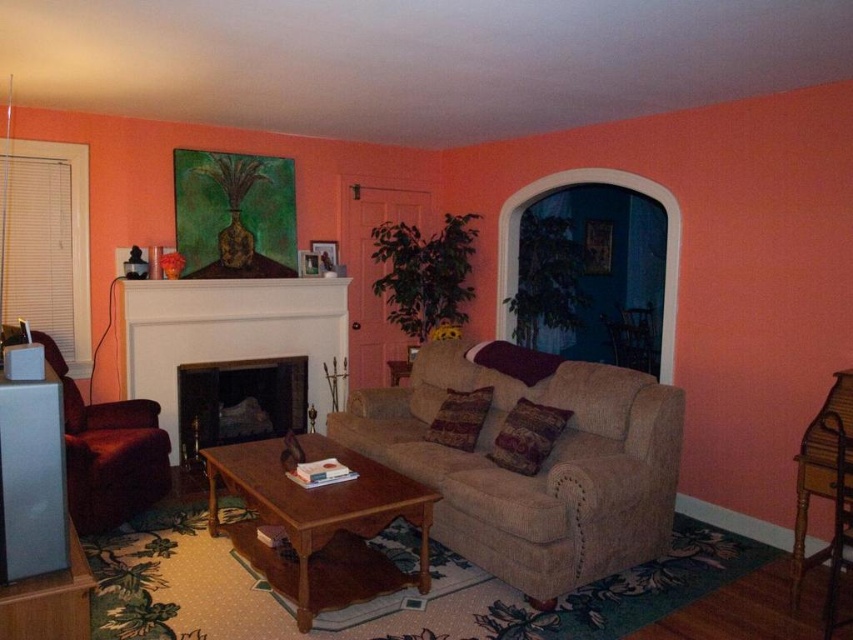
Can you confirm if beige corduroy couch at center is positioned to the right of matte black fireplace at center?

Indeed, beige corduroy couch at center is positioned on the right side of matte black fireplace at center.

Between beige corduroy couch at center and matte black fireplace at center, which one appears on the left side from the viewer's perspective?

Positioned to the left is matte black fireplace at center.

Measure the distance between point (x=462, y=477) and camera.

Point (x=462, y=477) is 3.46 meters away from camera.

Identify the location of beige corduroy couch at center. The image size is (853, 640). (537, 470).

Is beige corduroy couch at center below white glossy fireplace at center?

Indeed, beige corduroy couch at center is positioned under white glossy fireplace at center.

Who is positioned more to the right, beige corduroy couch at center or white glossy fireplace at center?

beige corduroy couch at center is more to the right.

At what (x,y) coordinates should I click in order to perform the action: click on beige corduroy couch at center. Please return your answer as a coordinate pair (x, y). The height and width of the screenshot is (640, 853). Looking at the image, I should click on (537, 470).

Who is positioned more to the left, brown wood coffee table at center or velvet maroon armchair at left?

velvet maroon armchair at left is more to the left.

Where is `brown wood coffee table at center`? This screenshot has height=640, width=853. brown wood coffee table at center is located at coordinates (318, 499).